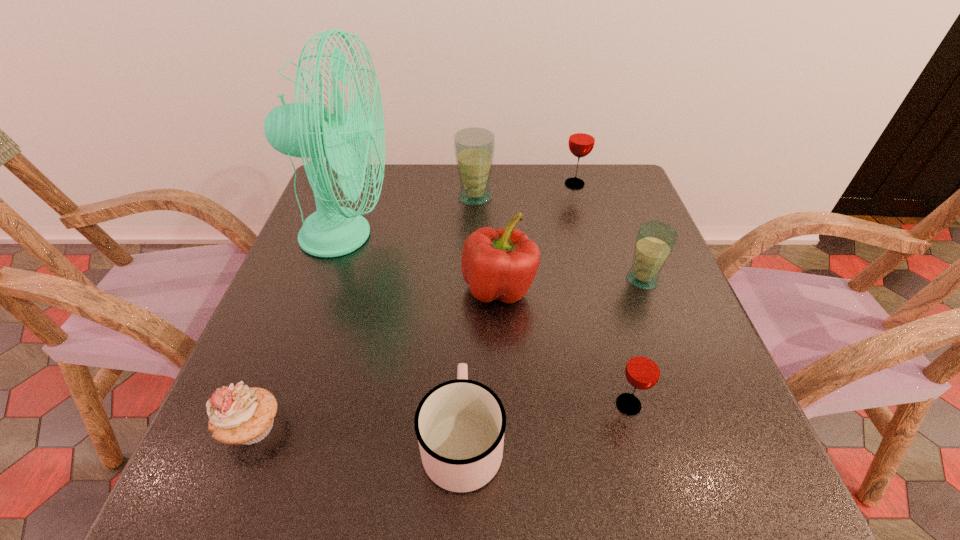
Identify the location of free area in between the smaller red glass and the mug. click(545, 422).

Find the location of a particular element. The height and width of the screenshot is (540, 960). vacant area that lies between the bigger red glass and the rightmost object is located at coordinates (609, 232).

What are the coordinates of `free spot between the cupcake and the farther blue glass` in the screenshot? It's located at (364, 312).

The height and width of the screenshot is (540, 960). Identify the location of unoccupied area between the nearest glass and the tallest object. (488, 320).

What are the coordinates of `free point between the pink bell pepper and the cupcake` in the screenshot? It's located at (375, 357).

Locate an element on the screen. The height and width of the screenshot is (540, 960). object that stands as the sixth closest to the farther red glass is located at coordinates (460, 424).

Locate an element on the screen. This screenshot has width=960, height=540. the second closest object to the bigger red glass is located at coordinates (655, 241).

Locate an element on the screen. glass that is the third closest to the bigger blue glass is located at coordinates (643, 370).

Locate which glass is the third closest to the mug. Please provide its 2D coordinates. Your answer should be formatted as a tuple, i.e. [(x, y)], where the tuple contains the x and y coordinates of a point satisfying the conditions above.

[(474, 148)]

Find the location of a particular element. vacant space that satisfies the following two spatial constraints: 1. in front of the blue fan to blow air; 2. on the left side of the nearest glass is located at coordinates (287, 404).